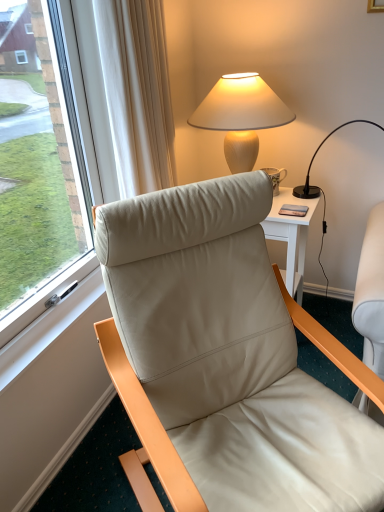
This screenshot has width=384, height=512. What do you see at coordinates (241, 116) in the screenshot? I see `matte beige lampshade at upper right, the 1th lamp viewed from the left` at bounding box center [241, 116].

Locate an element on the screen. The height and width of the screenshot is (512, 384). matte beige lampshade at upper right, the second lamp viewed from the right is located at coordinates (241, 116).

This screenshot has width=384, height=512. I want to click on matte black phone at upper right, so click(293, 210).

What do you see at coordinates (276, 177) in the screenshot? I see `porcelain floral mug at right` at bounding box center [276, 177].

What do you see at coordinates (227, 358) in the screenshot? The height and width of the screenshot is (512, 384). I see `leather at left` at bounding box center [227, 358].

Where is `leather at left`? The width and height of the screenshot is (384, 512). leather at left is located at coordinates click(x=227, y=358).

Locate an element on the screen. This screenshot has height=512, width=384. matte beige lampshade at upper right, the 1th lamp viewed from the left is located at coordinates (241, 116).

Could you tell me if porcelain floral mug at right is turned towards matte beige lampshade at upper right, the 1th lamp viewed from the left?

Yes, porcelain floral mug at right is turned towards matte beige lampshade at upper right, the 1th lamp viewed from the left.

From the picture: Can you confirm if porcelain floral mug at right is smaller than matte beige lampshade at upper right, the 1th lamp viewed from the left?

Yes, porcelain floral mug at right is smaller than matte beige lampshade at upper right, the 1th lamp viewed from the left.

From a real-world perspective, is porcelain floral mug at right located higher than matte beige lampshade at upper right, the second lamp viewed from the right?

No, from a real-world perspective, porcelain floral mug at right is not over matte beige lampshade at upper right, the second lamp viewed from the right

Is point (279, 169) positioned in front of point (275, 106)?

No.

Does black glass lamp at upper right, which is the first lamp in right-to-left order, have a smaller size compared to matte black phone at upper right?

No, black glass lamp at upper right, which is the first lamp in right-to-left order, is not smaller than matte black phone at upper right.

Considering the sizes of objects black glass lamp at upper right, which is the first lamp in right-to-left order, and matte black phone at upper right in the image provided, who is taller, black glass lamp at upper right, which is the first lamp in right-to-left order, or matte black phone at upper right?

With more height is black glass lamp at upper right, which is the first lamp in right-to-left order.

From the image's perspective, is black glass lamp at upper right, which is the first lamp in right-to-left order, positioned above or below matte black phone at upper right?

Clearly, from the image's perspective, black glass lamp at upper right, which is the first lamp in right-to-left order, is above matte black phone at upper right.

Where is `the 1st lamp positioned above the matte black phone at upper right (from the image's perspective)`? the 1st lamp positioned above the matte black phone at upper right (from the image's perspective) is located at coordinates (320, 188).

How much distance is there between leather at left and porcelain floral mug at right?

leather at left is 35.38 inches from porcelain floral mug at right.

The width and height of the screenshot is (384, 512). In order to click on chair located on the left of porcelain floral mug at right in this screenshot , I will do `click(227, 358)`.

Is leather at left completely or partially outside of porcelain floral mug at right?

Yes, leather at left is located beyond the bounds of porcelain floral mug at right.

Based on the photo, from a real-world perspective, is leather at left under porcelain floral mug at right?

Yes.

Does leather at left have a lesser height compared to matte black phone at upper right?

No, leather at left is not shorter than matte black phone at upper right.

Find the location of a particular element. This screenshot has height=512, width=384. chair to the left of matte black phone at upper right is located at coordinates (227, 358).

Can you see leather at left touching matte black phone at upper right?

leather at left and matte black phone at upper right are clearly separated.

Which object is more forward, leather at left or matte black phone at upper right?

leather at left is more forward.

From a real-world perspective, is porcelain floral mug at right physically below black glass lamp at upper right, arranged as the 2th lamp when viewed from the left?

Yes.

Considering the sizes of objects porcelain floral mug at right and black glass lamp at upper right, arranged as the 2th lamp when viewed from the left, in the image provided, who is smaller, porcelain floral mug at right or black glass lamp at upper right, arranged as the 2th lamp when viewed from the left,?

porcelain floral mug at right is smaller.

Is porcelain floral mug at right in contact with black glass lamp at upper right, arranged as the 2th lamp when viewed from the left?

porcelain floral mug at right and black glass lamp at upper right, arranged as the 2th lamp when viewed from the left, are not in contact.

Is porcelain floral mug at right turned away from black glass lamp at upper right, which is the first lamp in right-to-left order?

porcelain floral mug at right is not turned away from black glass lamp at upper right, which is the first lamp in right-to-left order.

Which object is thinner, porcelain floral mug at right or matte black phone at upper right?

Thinner between the two is porcelain floral mug at right.

Considering the sizes of objects porcelain floral mug at right and matte black phone at upper right in the image provided, who is taller, porcelain floral mug at right or matte black phone at upper right?

With more height is porcelain floral mug at right.

From the image's perspective, would you say porcelain floral mug at right is positioned over matte black phone at upper right?

Yes.

From the picture: Which is in front, porcelain floral mug at right or matte black phone at upper right?

matte black phone at upper right.

From the image's perspective, does matte beige lampshade at upper right, the 1th lamp viewed from the left, appear lower than leather at left?

No, from the image's perspective, matte beige lampshade at upper right, the 1th lamp viewed from the left, is not below leather at left.

Considering the sizes of matte beige lampshade at upper right, the second lamp viewed from the right, and leather at left in the image, is matte beige lampshade at upper right, the second lamp viewed from the right, wider or thinner than leather at left?

Clearly, matte beige lampshade at upper right, the second lamp viewed from the right, has less width compared to leather at left.

Which of these two, matte beige lampshade at upper right, the second lamp viewed from the right, or leather at left, stands taller?

With more height is leather at left.

Is leather at left located within matte beige lampshade at upper right, the second lamp viewed from the right?

No, leather at left is located outside of matte beige lampshade at upper right, the second lamp viewed from the right.

Locate an element on the screen. This screenshot has width=384, height=512. the 2nd lamp in front of the porcelain floral mug at right, starting your count from the anchor is located at coordinates (241, 116).

Locate an element on the screen. The width and height of the screenshot is (384, 512). mobile phone located on the left of black glass lamp at upper right, which is the first lamp in right-to-left order is located at coordinates (293, 210).

Looking at this image, estimate the real-world distances between objects in this image. Which object is closer to leather at left, matte black phone at upper right or black glass lamp at upper right, which is the first lamp in right-to-left order?

matte black phone at upper right is closer to leather at left.

Based on the photo, considering their positions, is porcelain floral mug at right positioned further to leather at left than matte beige lampshade at upper right, the 1th lamp viewed from the left?

porcelain floral mug at right.

In the scene shown: When comparing their distances from leather at left, does black glass lamp at upper right, arranged as the 2th lamp when viewed from the left, or matte beige lampshade at upper right, the 1th lamp viewed from the left, seem closer?

matte beige lampshade at upper right, the 1th lamp viewed from the left, lies closer to leather at left than the other object.

Looking at the image, which one is located further to matte beige lampshade at upper right, the 1th lamp viewed from the left, porcelain floral mug at right or black glass lamp at upper right, which is the first lamp in right-to-left order?

black glass lamp at upper right, which is the first lamp in right-to-left order.

From the image, which object appears to be farther from porcelain floral mug at right, black glass lamp at upper right, arranged as the 2th lamp when viewed from the left, or matte black phone at upper right?

Among the two, black glass lamp at upper right, arranged as the 2th lamp when viewed from the left, is located further to porcelain floral mug at right.

Considering their positions, is matte beige lampshade at upper right, the 1th lamp viewed from the left, positioned further to leather at left than porcelain floral mug at right?

The object further to leather at left is porcelain floral mug at right.

From the image, which object appears to be nearer to porcelain floral mug at right, leather at left or matte beige lampshade at upper right, the 1th lamp viewed from the left?

matte beige lampshade at upper right, the 1th lamp viewed from the left, is positioned closer to the anchor porcelain floral mug at right.

From the image, which object appears to be nearer to matte black phone at upper right, leather at left or black glass lamp at upper right, arranged as the 2th lamp when viewed from the left?

The object closer to matte black phone at upper right is black glass lamp at upper right, arranged as the 2th lamp when viewed from the left.

Image resolution: width=384 pixels, height=512 pixels. Identify the location of lamp positioned between leather at left and black glass lamp at upper right, which is the first lamp in right-to-left order, from near to far. (241, 116).

Image resolution: width=384 pixels, height=512 pixels. I want to click on mobile phone between matte beige lampshade at upper right, the 1th lamp viewed from the left, and porcelain floral mug at right, along the z-axis, so click(293, 210).

The height and width of the screenshot is (512, 384). Identify the location of coffee cup between matte beige lampshade at upper right, the second lamp viewed from the right, and black glass lamp at upper right, which is the first lamp in right-to-left order. (276, 177).

You are a GUI agent. You are given a task and a screenshot of the screen. Output one action in this format:
    pyautogui.click(x=<x>, y=<y>)
    Task: Click on the mobile phone between black glass lamp at upper right, arranged as the 2th lamp when viewed from the left, and porcelain floral mug at right from front to back
    This screenshot has height=512, width=384.
    Given the screenshot: What is the action you would take?
    pyautogui.click(x=293, y=210)